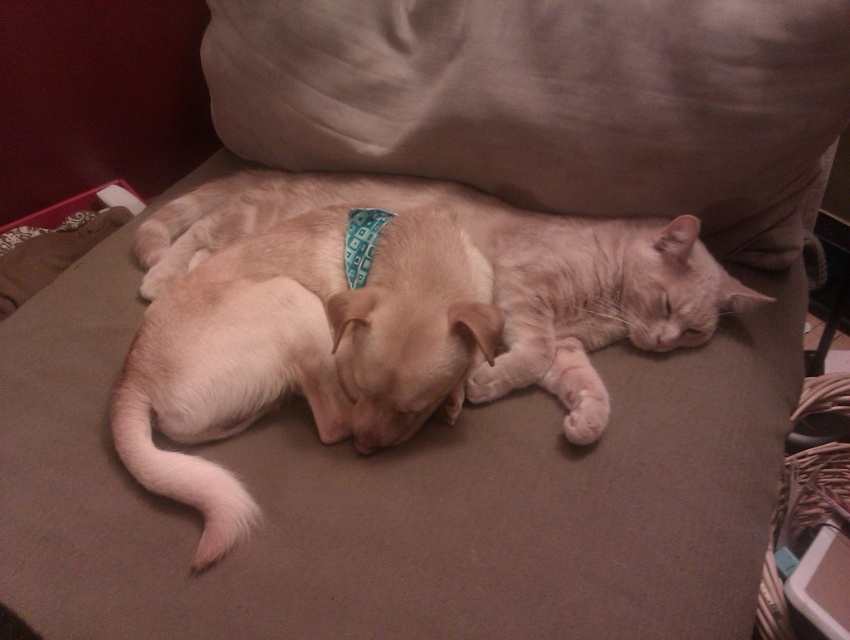
Question: Does beige fabric pillow at upper center appear on the left side of fuzzy beige dog at center?

Choices:
 (A) no
 (B) yes

Answer: (A)

Question: Among these points, which one is farthest from the camera?

Choices:
 (A) (408, 266)
 (B) (672, 280)
 (C) (219, 77)

Answer: (C)

Question: Does beige fabric pillow at upper center come in front of fuzzy beige dog at center?

Choices:
 (A) yes
 (B) no

Answer: (B)

Question: Can you confirm if beige fabric pillow at upper center is thinner than light brown fur at center?

Choices:
 (A) yes
 (B) no

Answer: (B)

Question: Estimate the real-world distances between objects in this image. Which object is closer to the beige fabric pillow at upper center?

Choices:
 (A) fuzzy beige dog at center
 (B) light brown fur at center

Answer: (B)

Question: Which object is the farthest from the light brown fur at center?

Choices:
 (A) fuzzy beige dog at center
 (B) beige fabric pillow at upper center

Answer: (A)